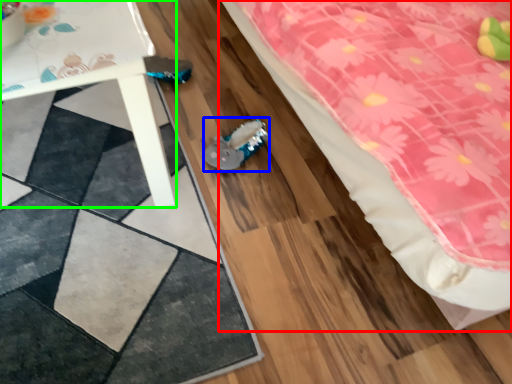
Question: Which object is positioned closest to bed (highlighted by a red box)? Select from stuff (highlighted by a blue box) and table (highlighted by a green box).

Choices:
 (A) stuff
 (B) table

Answer: (A)